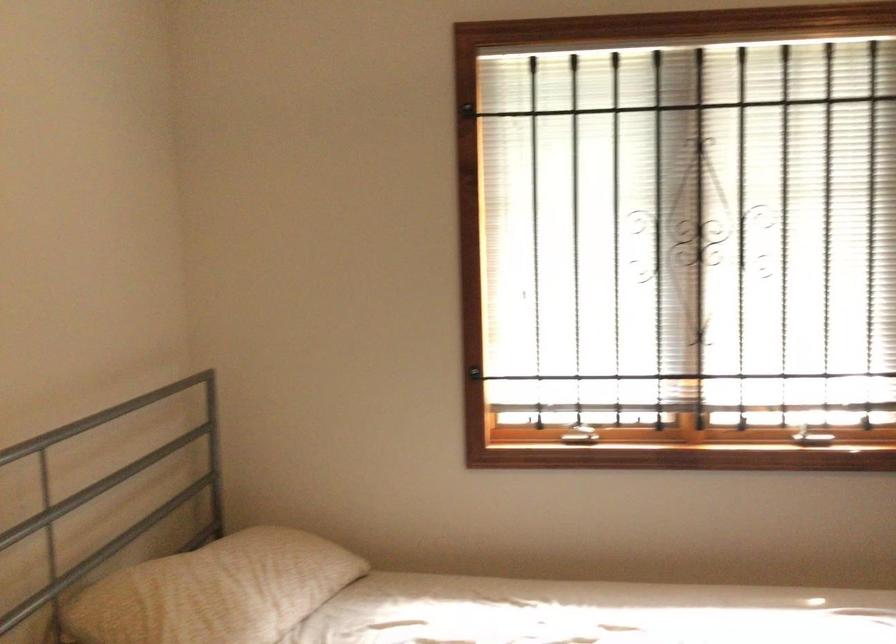
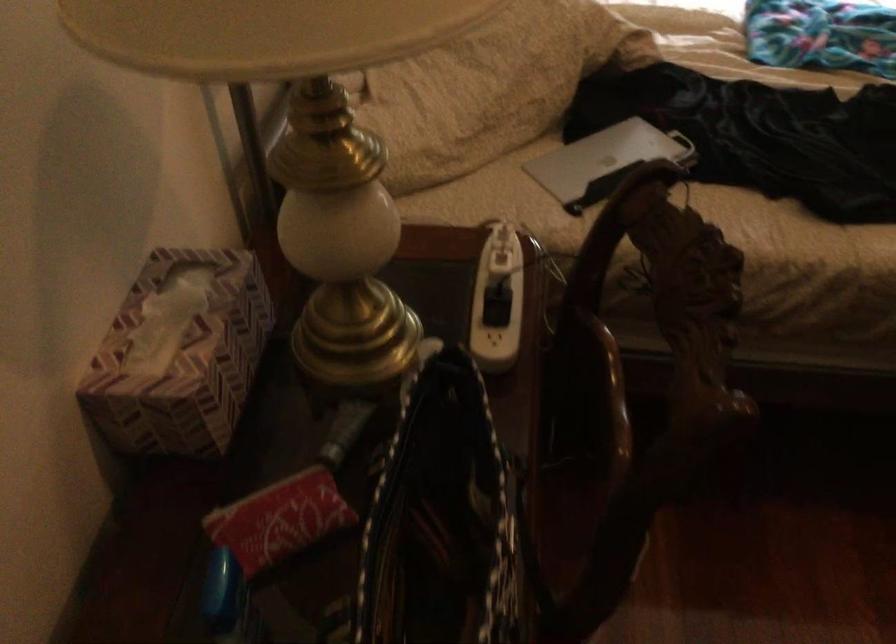
Question: Based on the continuous images, in which direction is the camera rotating? Reply with the corresponding letter.

Choices:
 (A) Left
 (B) Right
 (C) Up
 (D) Down

Answer: (D)